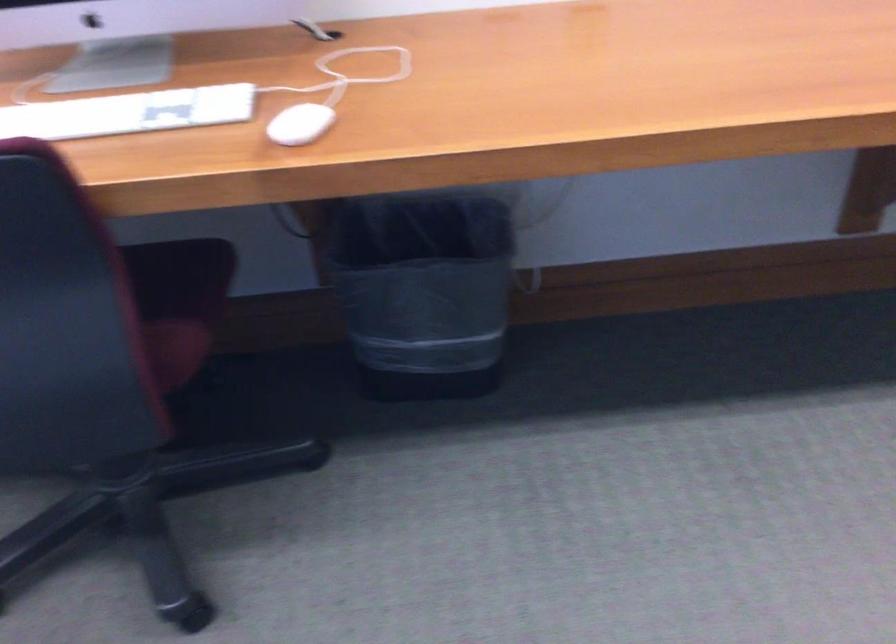
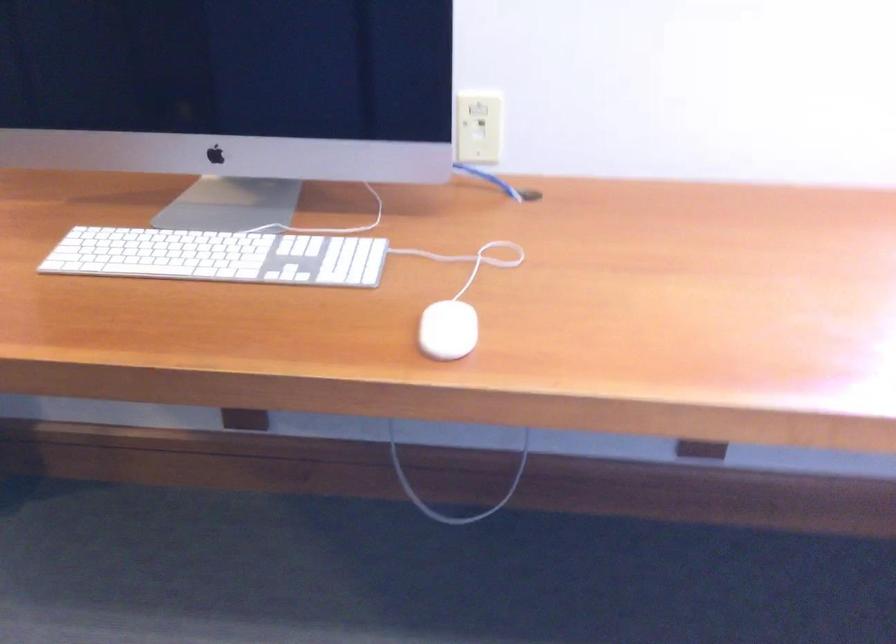
Question: What movement of the cameraman would produce the second image?

Choices:
 (A) Left
 (B) Right
 (C) Forward
 (D) Backward

Answer: (A)